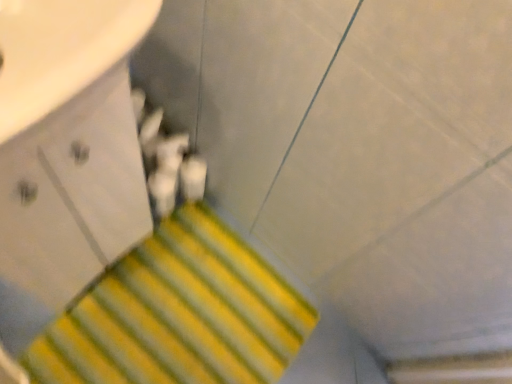
Question: From the image's perspective, is yellow striped carpet at lower center under white glossy drawer at upper left?

Choices:
 (A) no
 (B) yes

Answer: (B)

Question: Is the depth of yellow striped carpet at lower center less than that of white glossy drawer at upper left?

Choices:
 (A) yes
 (B) no

Answer: (B)

Question: Considering the relative positions of yellow striped carpet at lower center and white glossy drawer at upper left in the image provided, is yellow striped carpet at lower center behind white glossy drawer at upper left?

Choices:
 (A) yes
 (B) no

Answer: (A)

Question: From a real-world perspective, is yellow striped carpet at lower center physically above white glossy drawer at upper left?

Choices:
 (A) no
 (B) yes

Answer: (A)

Question: Is yellow striped carpet at lower center looking in the opposite direction of white glossy drawer at upper left?

Choices:
 (A) yes
 (B) no

Answer: (B)

Question: Does yellow striped carpet at lower center have a greater height compared to white glossy drawer at upper left?

Choices:
 (A) yes
 (B) no

Answer: (B)

Question: Does white glossy drawer at upper left have a lesser height compared to yellow striped carpet at lower center?

Choices:
 (A) yes
 (B) no

Answer: (B)

Question: From a real-world perspective, is white glossy drawer at upper left positioned over yellow striped carpet at lower center based on gravity?

Choices:
 (A) yes
 (B) no

Answer: (A)

Question: Are white glossy drawer at upper left and yellow striped carpet at lower center beside each other?

Choices:
 (A) no
 (B) yes

Answer: (A)

Question: Considering the relative sizes of white glossy drawer at upper left and yellow striped carpet at lower center in the image provided, is white glossy drawer at upper left thinner than yellow striped carpet at lower center?

Choices:
 (A) no
 (B) yes

Answer: (B)

Question: Is white glossy drawer at upper left positioned behind yellow striped carpet at lower center?

Choices:
 (A) no
 (B) yes

Answer: (A)

Question: Is white glossy drawer at upper left at the left side of yellow striped carpet at lower center?

Choices:
 (A) no
 (B) yes

Answer: (B)

Question: Choose the correct answer: Is white glossy drawer at upper left inside yellow striped carpet at lower center or outside it?

Choices:
 (A) inside
 (B) outside

Answer: (B)